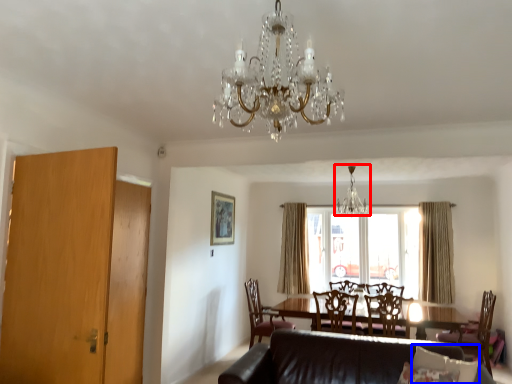
Question: Which object is closer to the camera taking this photo, chandelier (highlighted by a red box) or pillow (highlighted by a blue box)?

Choices:
 (A) chandelier
 (B) pillow

Answer: (B)